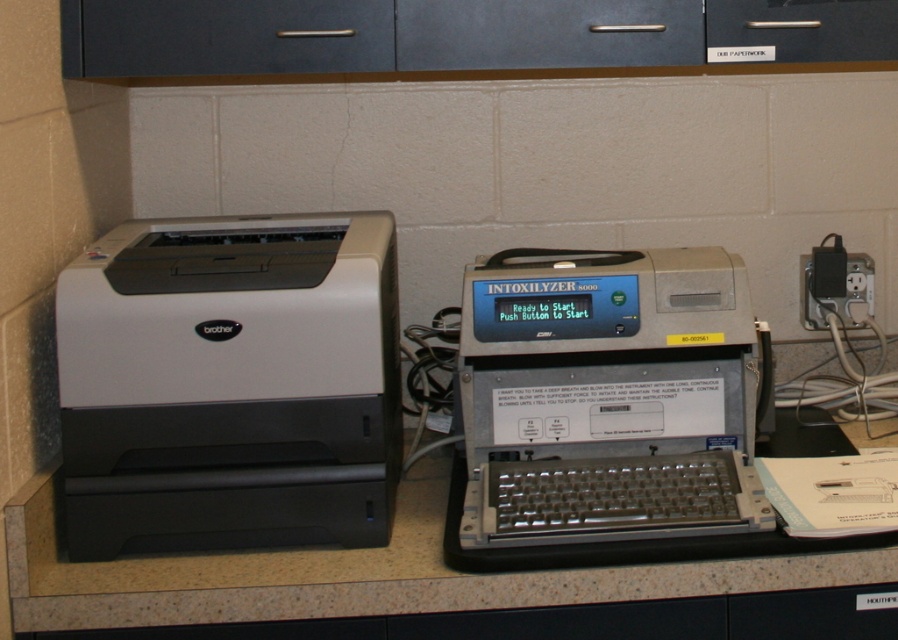
The width and height of the screenshot is (898, 640). What are the coordinates of `matte black printer at left` in the screenshot? It's located at (230, 385).

Which is more to the right, matte black printer at left or granite countertop at center?

granite countertop at center is more to the right.

Is point (359, 442) in front of point (771, 612)?

No, (359, 442) is further to viewer.

Identify the location of matte black printer at left. (230, 385).

Identify the location of gray plastic intoxilyzer at center. The height and width of the screenshot is (640, 898). (604, 410).

Is gray plastic intoxilyzer at center positioned before dark gray matte drawer at upper center?

That is True.

Which is in front, point (643, 355) or point (181, 49)?

Positioned in front is point (181, 49).

Locate an element on the screen. gray plastic intoxilyzer at center is located at coordinates (604, 410).

What do you see at coordinates (230, 385) in the screenshot?
I see `matte black printer at left` at bounding box center [230, 385].

Is matte black printer at left shorter than dark gray matte drawer at upper center?

Incorrect, matte black printer at left's height does not fall short of dark gray matte drawer at upper center's.

Is point (314, 380) less distant than point (235, 19)?

That is True.

Locate an element on the screen. The image size is (898, 640). matte black printer at left is located at coordinates (230, 385).